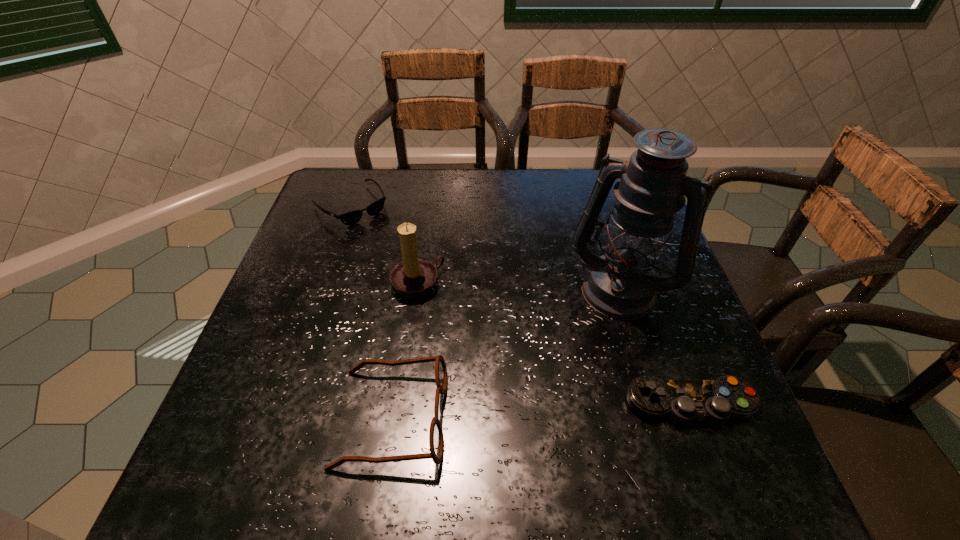
This screenshot has height=540, width=960. What are the coordinates of `vacant region at the near left corner of the desktop` in the screenshot? It's located at (244, 393).

Find the location of `free area in between the fourth shortest object and the tallest object`. free area in between the fourth shortest object and the tallest object is located at coordinates (518, 285).

Find the location of a particular element. blank region between the third tallest object and the candle holder is located at coordinates (405, 351).

Image resolution: width=960 pixels, height=540 pixels. What are the coordinates of `empty space between the lantern and the control` in the screenshot? It's located at (656, 346).

The image size is (960, 540). I want to click on free space between the spectacles and the farthest object, so click(372, 311).

Find the location of a particular element. The image size is (960, 540). free space between the fourth shortest object and the control is located at coordinates (554, 345).

This screenshot has width=960, height=540. I want to click on vacant space that's between the tallest object and the control, so click(656, 346).

Where is `vacant space that is in between the leftmost object and the control`? The height and width of the screenshot is (540, 960). vacant space that is in between the leftmost object and the control is located at coordinates (520, 305).

At what (x,y) coordinates should I click in order to perform the action: click on vacant space that's between the tallest object and the leftmost object. Please return your answer as a coordinate pair (x, y). The width and height of the screenshot is (960, 540). Looking at the image, I should click on (486, 246).

You are a GUI agent. You are given a task and a screenshot of the screen. Output one action in this format:
    pyautogui.click(x=<x>, y=<y>)
    Task: Click on the vacant point located between the spectacles and the tallest object
    The height and width of the screenshot is (540, 960).
    Given the screenshot: What is the action you would take?
    pyautogui.click(x=506, y=352)